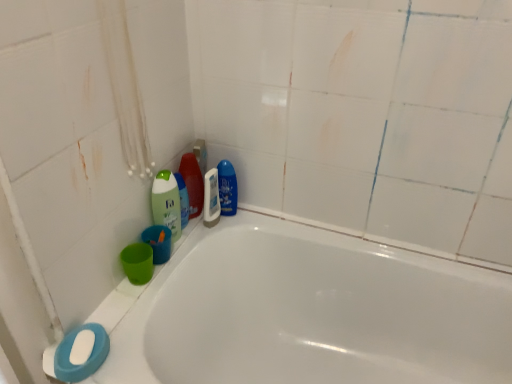
Identify the location of empty space that is to the right of green matte bottle at upper left, arranged as the fourth cleaning product when viewed from the right. (211, 231).